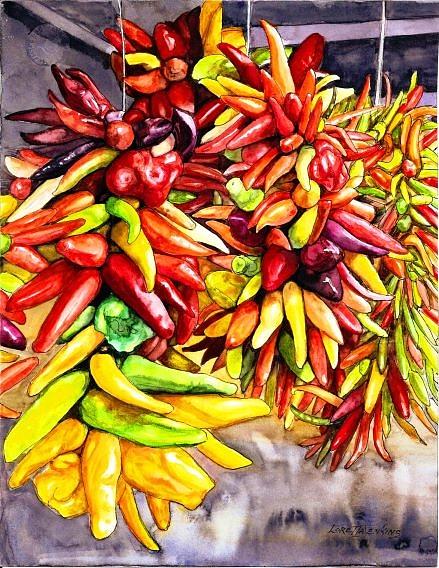
You are a GUI agent. You are given a task and a screenshot of the screen. Output one action in this format:
    pyautogui.click(x=<x>, y=<y>)
    Task: Click on the ceiling
    This screenshot has width=439, height=568.
    Given the screenshot: What is the action you would take?
    pyautogui.click(x=99, y=16)